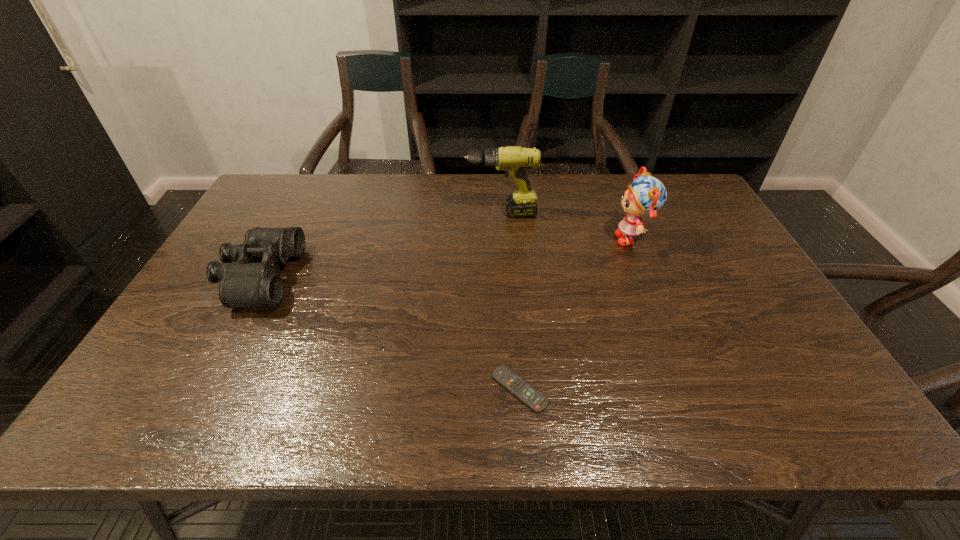
Where is `vacant space at the right edge of the desktop`? This screenshot has width=960, height=540. vacant space at the right edge of the desktop is located at coordinates (744, 310).

In the image, there is a desktop. Where is `vacant space at the far left corner`? The image size is (960, 540). vacant space at the far left corner is located at coordinates (275, 174).

Where is `vacant region at the near left corner of the desktop`? This screenshot has width=960, height=540. vacant region at the near left corner of the desktop is located at coordinates (188, 411).

I want to click on blank space at the near right corner, so click(771, 405).

Locate an element on the screen. free point between the doll and the third tallest object is located at coordinates (446, 258).

This screenshot has width=960, height=540. Find the location of `free space between the binoculars and the shortest object`. free space between the binoculars and the shortest object is located at coordinates (390, 333).

I want to click on vacant area that lies between the second shortest object and the remote control, so click(x=390, y=333).

You are a GUI agent. You are given a task and a screenshot of the screen. Output one action in this format:
    pyautogui.click(x=<x>, y=<y>)
    Task: Click on the free spot between the leftmost object and the drill
    The width and height of the screenshot is (960, 540).
    Given the screenshot: What is the action you would take?
    pyautogui.click(x=380, y=245)

You are a GUI agent. You are given a task and a screenshot of the screen. Output one action in this format:
    pyautogui.click(x=<x>, y=<y>)
    Task: Click on the vacant space that's between the leftmost object and the doll
    The width and height of the screenshot is (960, 540).
    Given the screenshot: What is the action you would take?
    pyautogui.click(x=446, y=258)

The height and width of the screenshot is (540, 960). I want to click on free space between the remote control and the third tallest object, so click(x=390, y=333).